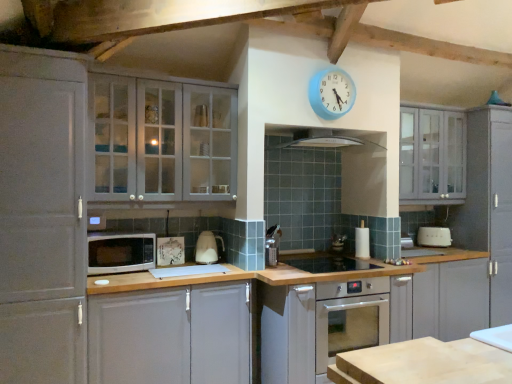
Where is `free space above blue plastic clock at upper center (from a real-world perspective)`? free space above blue plastic clock at upper center (from a real-world perspective) is located at coordinates (329, 69).